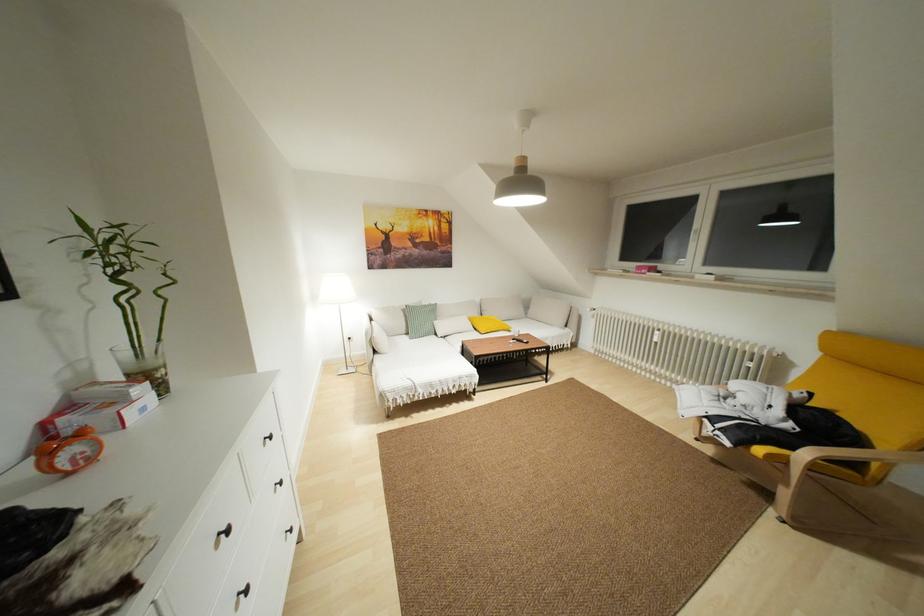
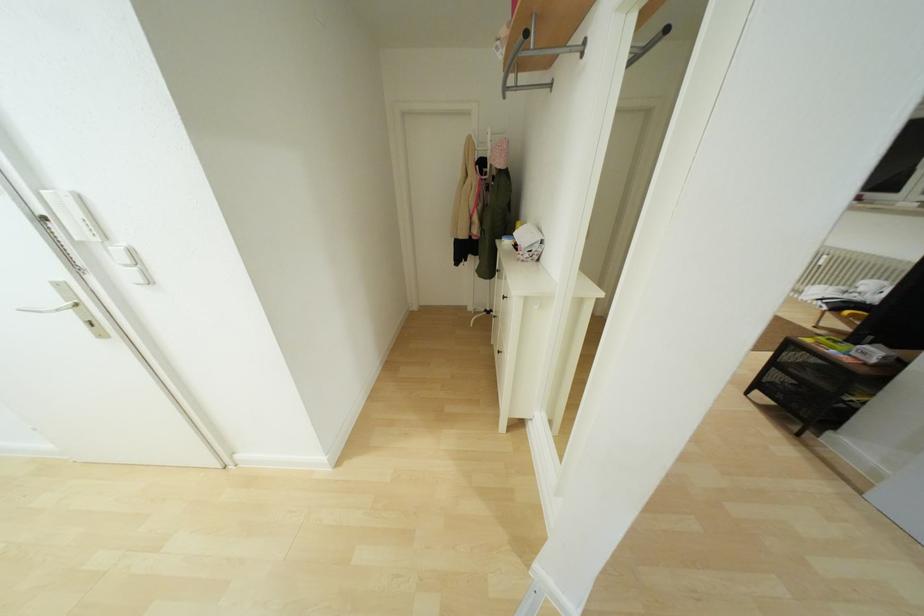
Question: In a continuous first-person perspective shot, in which direction is the camera moving?

Choices:
 (A) Left
 (B) Right
 (C) Forward
 (D) Backward

Answer: (D)